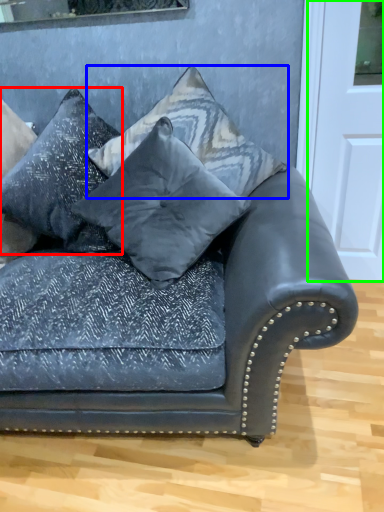
Question: Which is farther away from pillow (highlighted by a red box)? pillow (highlighted by a blue box) or door (highlighted by a green box)?

Choices:
 (A) pillow
 (B) door

Answer: (B)